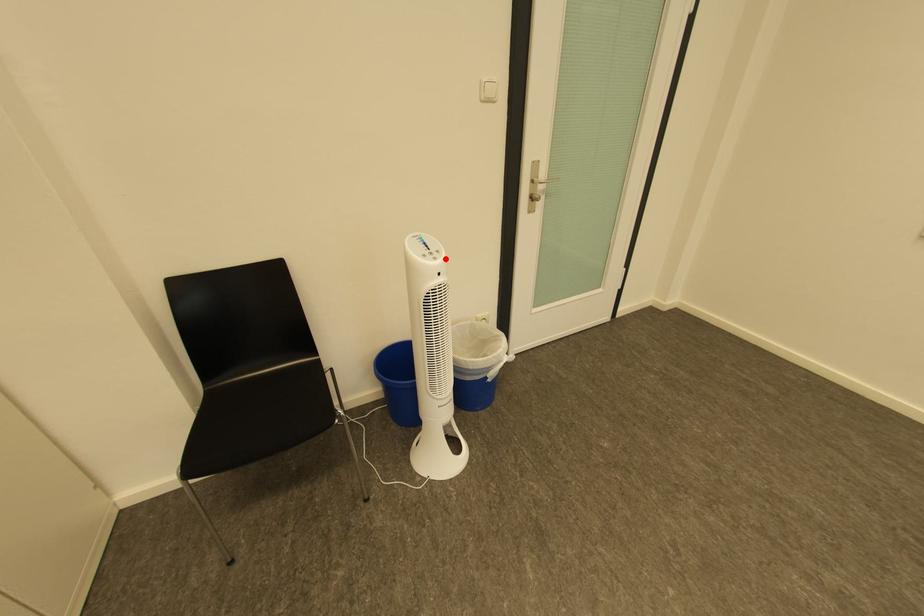
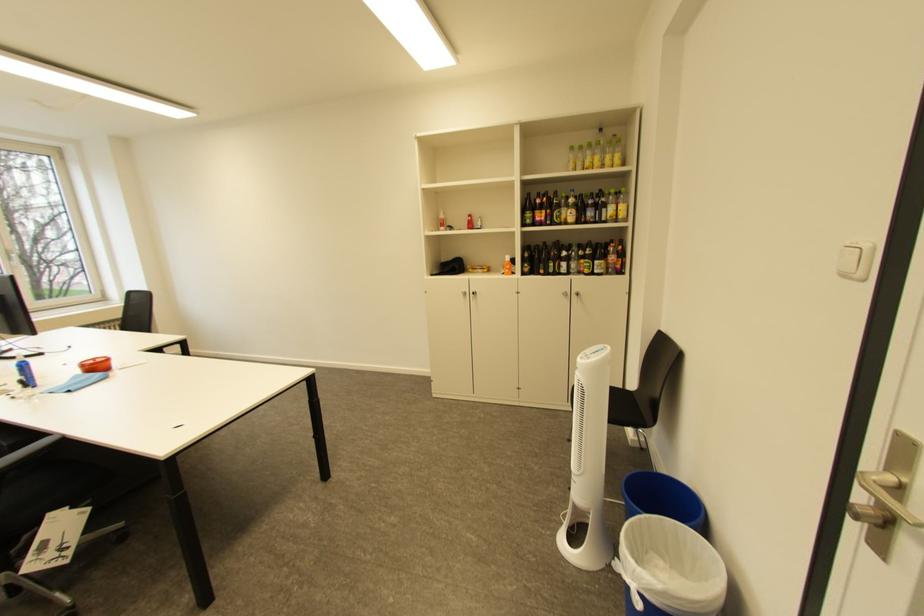
Find the pixel in the second image that matches the highlighted location in the first image.

(591, 359)